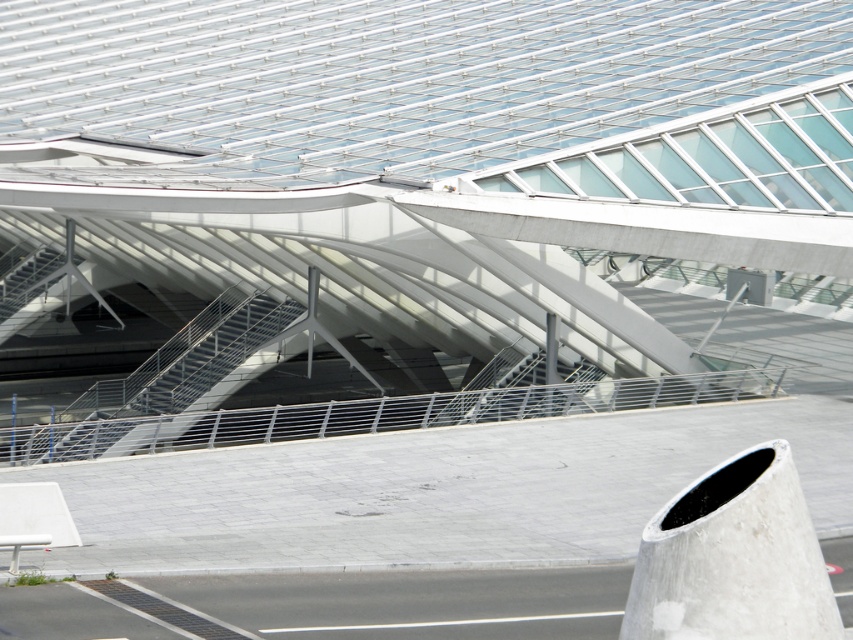
You are standing at the entrance of the transportation hub and want to reach the upper level. The metallic gray stair at center is your only option. Based on its 2D coordinates, can you estimate its position relative to your current location?

The metallic gray stair at center is located at coordinates point (511, 390), which is to the right and slightly forward of your current position at the entrance.

You are standing at the entrance of the transportation hub and see the point marked at coordinates [166,376]. What is the location of this point relative to the metallic gray stairs at center?

The point [166,376] is located on the metallic gray stairs at center.

You are a maintenance worker needing to ascend to the roof framework. You see the metallic gray stairs at center and the metallic gray stair at center. Which one should you use to reach the roof framework efficiently?

The metallic gray stairs at center is bigger than the metallic gray stair at center, so you should use the metallic gray stairs at center to reach the roof framework efficiently as it likely provides a more stable and direct path.